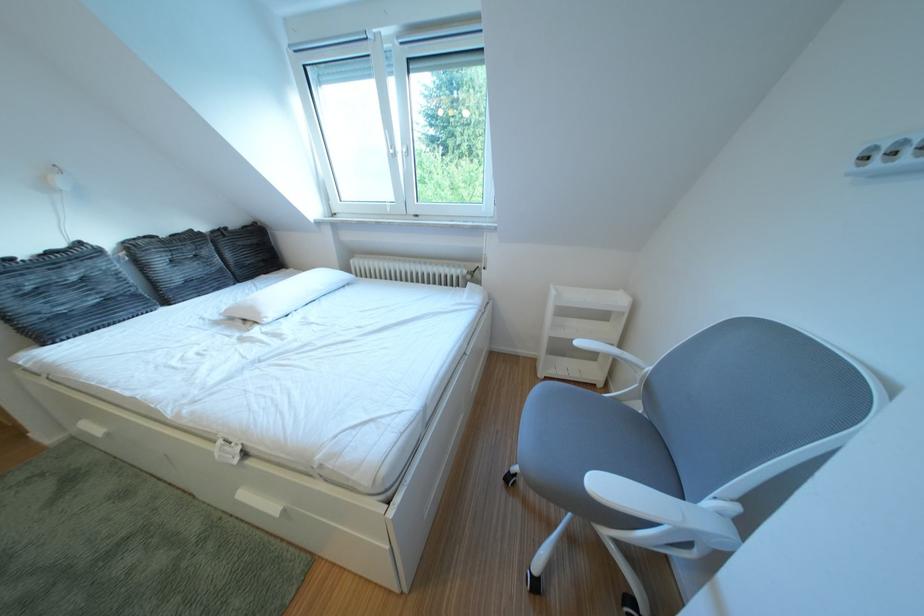
The height and width of the screenshot is (616, 924). In order to click on long white pillow in this screenshot , I will do `click(286, 294)`.